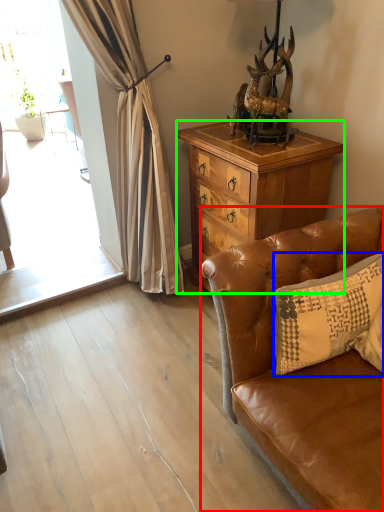
Question: Which object is the farthest from studio couch (highlighted by a red box)? Choose among these: pillow (highlighted by a blue box) or cabinetry (highlighted by a green box).

Choices:
 (A) pillow
 (B) cabinetry

Answer: (B)